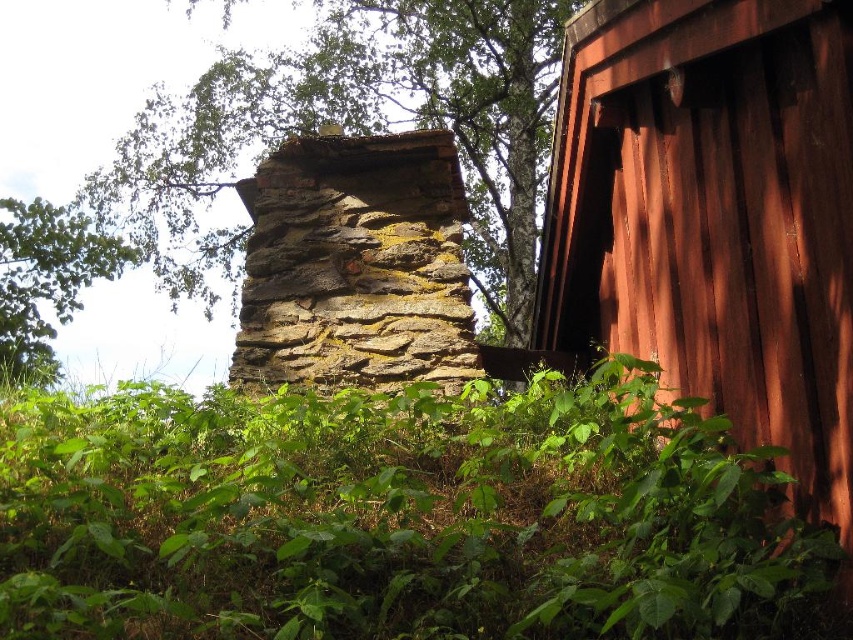
Does weathered stone chimney at center appear over green leafy tree at upper left?

Correct, weathered stone chimney at center is located above green leafy tree at upper left.

Can you confirm if weathered stone chimney at center is positioned to the left of green leafy tree at upper left?

No, weathered stone chimney at center is not to the left of green leafy tree at upper left.

Who is more distant from viewer, (264,284) or (39,241)?

The point (39,241) is more distant.

You are a GUI agent. You are given a task and a screenshot of the screen. Output one action in this format:
    pyautogui.click(x=<x>, y=<y>)
    Task: Click on the weathered stone chimney at center
    This screenshot has width=853, height=640.
    Given the screenshot: What is the action you would take?
    pyautogui.click(x=355, y=266)

Is green leafy vegetation at center further to camera compared to rusty wood cabin at right?

No.

Between green leafy vegetation at center and rusty wood cabin at right, which one has more height?

With more height is rusty wood cabin at right.

Is point (386, 397) less distant than point (741, 246)?

No, it is behind (741, 246).

I want to click on green leafy vegetation at center, so click(399, 516).

Which is in front, point (148, 440) or point (68, 208)?

Point (148, 440) is in front.

Who is more distant from viewer, (689,525) or (103,276)?

Point (103,276)

At what (x,y) coordinates should I click in order to perform the action: click on green leafy vegetation at center. Please return your answer as a coordinate pair (x, y). This screenshot has width=853, height=640. Looking at the image, I should click on (399, 516).